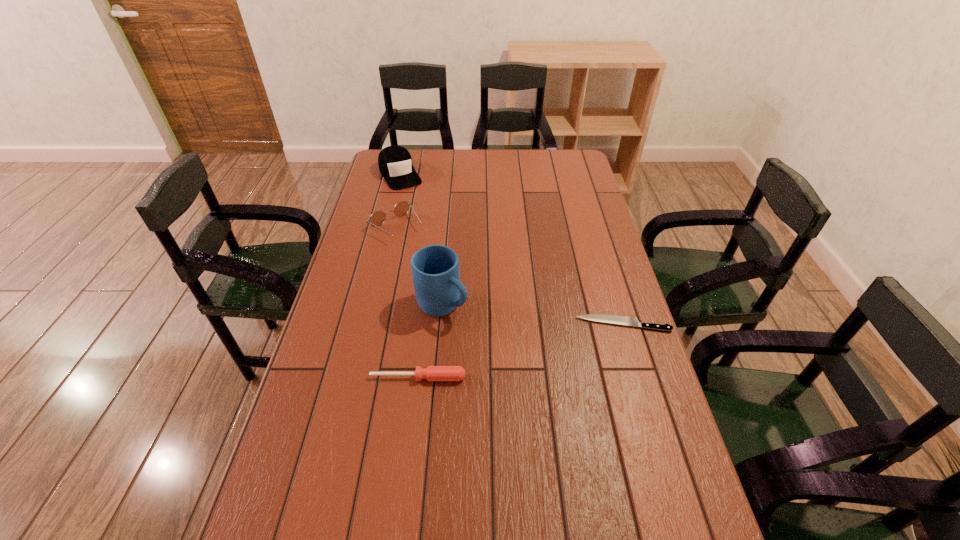
The width and height of the screenshot is (960, 540). I want to click on empty space that is in between the nearest object and the shortest object, so click(x=520, y=350).

Identify the location of free space between the nearest object and the tallest object. This screenshot has height=540, width=960. [x=430, y=341].

Where is `free space between the farthest object and the spectacles`? This screenshot has height=540, width=960. free space between the farthest object and the spectacles is located at coordinates pyautogui.click(x=398, y=201).

I want to click on empty location between the shortest object and the mug, so click(x=533, y=315).

Where is `unoccupied area between the steak knife and the farthest object`? The image size is (960, 540). unoccupied area between the steak knife and the farthest object is located at coordinates (512, 249).

This screenshot has width=960, height=540. What are the coordinates of `vacant space that is in between the mug and the steak knife` in the screenshot? It's located at (533, 315).

Locate an element on the screen. The height and width of the screenshot is (540, 960). free point between the nearest object and the rightmost object is located at coordinates (520, 350).

Locate an element on the screen. This screenshot has height=540, width=960. empty space that is in between the mug and the steak knife is located at coordinates (533, 315).

Where is `object that stands as the closest to the rightmost object`? This screenshot has width=960, height=540. object that stands as the closest to the rightmost object is located at coordinates (435, 268).

Select which object is the second closest to the shortest object. Please provide its 2D coordinates. Your answer should be formatted as a tuple, i.e. [(x, y)], where the tuple contains the x and y coordinates of a point satisfying the conditions above.

[(432, 373)]